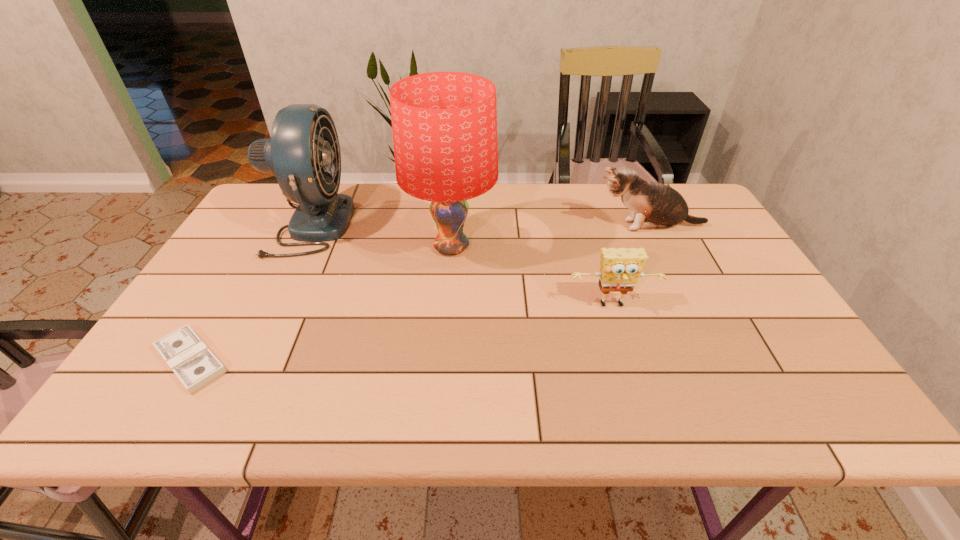
Where is `free space located at the face of the third shortest object`? This screenshot has width=960, height=540. free space located at the face of the third shortest object is located at coordinates (536, 226).

Image resolution: width=960 pixels, height=540 pixels. Find the location of `free point located 0.210m at the face of the third shortest object`. free point located 0.210m at the face of the third shortest object is located at coordinates (522, 226).

Image resolution: width=960 pixels, height=540 pixels. I want to click on vacant region located at the face of the third shortest object, so click(x=506, y=226).

Locate an element on the screen. This screenshot has width=960, height=540. vacant space located on the face of the fourth tallest object is located at coordinates click(634, 375).

This screenshot has height=540, width=960. In order to click on vacant space located on the right of the nearest object in this screenshot , I will do `click(361, 360)`.

Locate an element on the screen. lampshade at the far edge is located at coordinates (444, 124).

Identify the location of fan located in the far edge section of the desktop. (303, 152).

The image size is (960, 540). Find the location of `cat positioned at the far edge`. cat positioned at the far edge is located at coordinates (653, 205).

Find the location of a particular element. The image size is (960, 540). object present at the near edge is located at coordinates (190, 359).

Where is `fan located in the left edge section of the desktop`? This screenshot has height=540, width=960. fan located in the left edge section of the desktop is located at coordinates (303, 152).